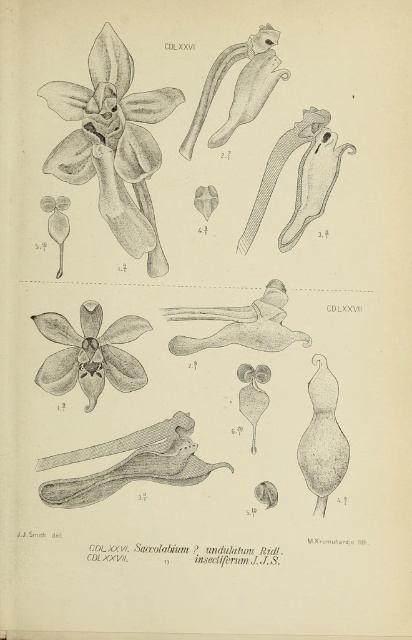
You are an entomologist examining a botanical illustration of orchids. You need to locate the matte black orchid at upper left for your study. Based on the illustration, what are the coordinates of its position?

The matte black orchid at upper left is located at coordinates point [112,144].

You are a botanist examining a botanical illustration of orchids. You notice two matte black orchid at upper left and matte black orchid at center. Which one is bigger in size?

The matte black orchid at upper left is larger in size than the matte black orchid at center.